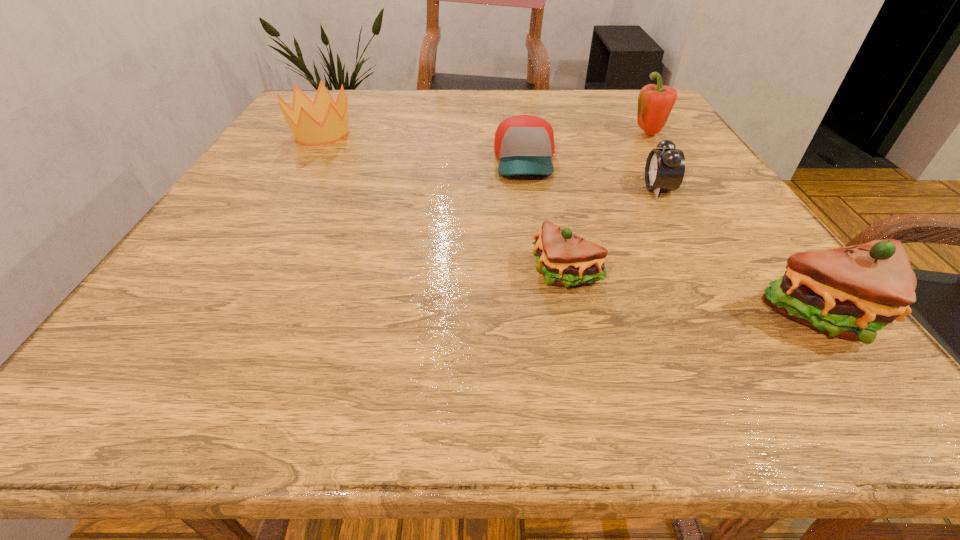
In order to click on free space that satisfies the following two spatial constraints: 1. on the front side of the alarm clock; 2. on the left side of the right sandwich in this screenshot , I will do `click(729, 318)`.

The width and height of the screenshot is (960, 540). Find the location of `free space that satisfies the following two spatial constraints: 1. at the brim of the left sandwich; 2. on the right side of the baseball cap`. free space that satisfies the following two spatial constraints: 1. at the brim of the left sandwich; 2. on the right side of the baseball cap is located at coordinates (541, 273).

Identify the location of vacant region that satisfies the following two spatial constraints: 1. on the front side of the taller sandwich; 2. on the right side of the alarm clock. (729, 318).